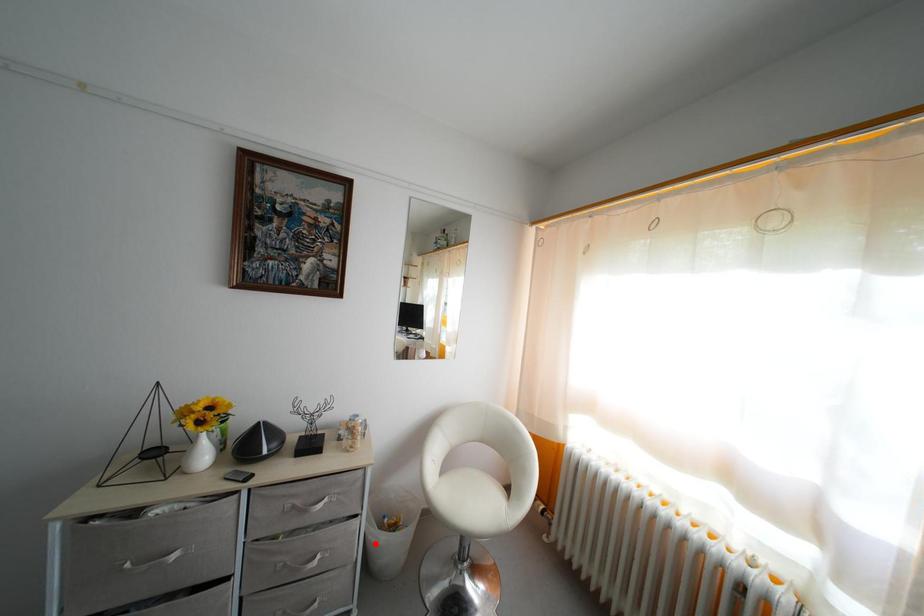
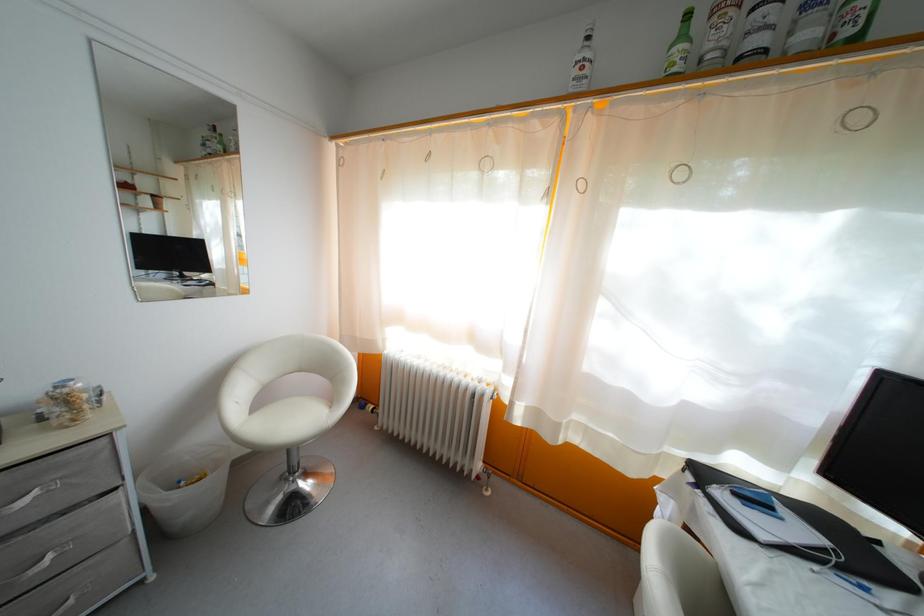
Where in the second image is the point corresponding to the highlighted location from the first image?

(160, 512)